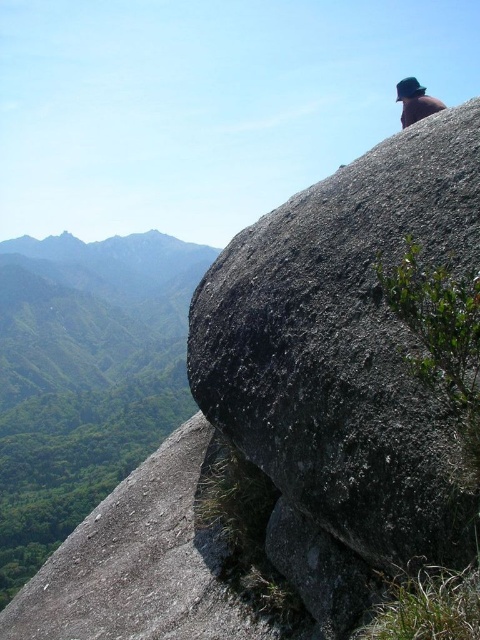
You are a hiker who has just reached the summit and is looking at the gray rough boulder at upper right and the green felt hat at upper right. Which object is positioned lower in the image?

The gray rough boulder at upper right is located below the green felt hat at upper right, so it is positioned lower in the image.

You are a hiker who wants to place your green felt hat at upper right on the gray rough boulder at upper right. Based on the scene, will the hat fit on the boulder?

The gray rough boulder at upper right occupies less space than the green felt hat at upper right, so the hat will not fit on the boulder.

You are a hiker standing at the base of the gray rough boulder at upper right. You want to take a photo of the boulder with your camera, which has a maximum zoom range of 10 meters. Can you capture the entire boulder in your photo without moving closer?

The gray rough boulder at upper right is 9.43 meters away from the camera. Since the camera has a maximum zoom range of 10 meters, you can capture the entire boulder in your photo without moving closer.